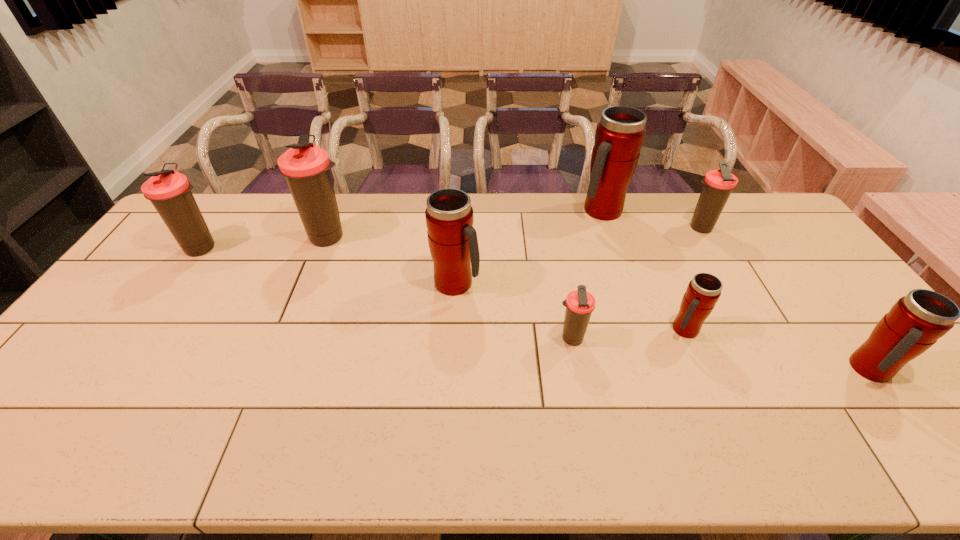
Image resolution: width=960 pixels, height=540 pixels. Identify the location of the rightmost red thermos bottle. (916, 321).

Locate an element on the screen. This screenshot has width=960, height=540. the smallest red thermos bottle is located at coordinates (703, 291).

Image resolution: width=960 pixels, height=540 pixels. I want to click on the fifth object from right to left, so click(580, 304).

I want to click on the smallest brown thermos bottle, so click(x=580, y=304).

Image resolution: width=960 pixels, height=540 pixels. Identify the location of free location located on the side with the handle of the biggest red thermos bottle. (x=625, y=280).

I want to click on blank area located 0.060m on the right of the biggest brown thermos bottle, so click(372, 237).

Identify the location of vacant area situated on the back of the leftmost object. Image resolution: width=960 pixels, height=540 pixels. (241, 193).

Find the location of a particular element. vacant space located 0.210m on the side with the handle of the third nearest red thermos bottle is located at coordinates (549, 284).

Identify the location of vacant space located on the right of the second object from right to left. This screenshot has height=540, width=960. (741, 228).

Locate an element on the screen. This screenshot has height=540, width=960. blank space located 0.170m on the side with the handle of the rightmost red thermos bottle is located at coordinates (937, 459).